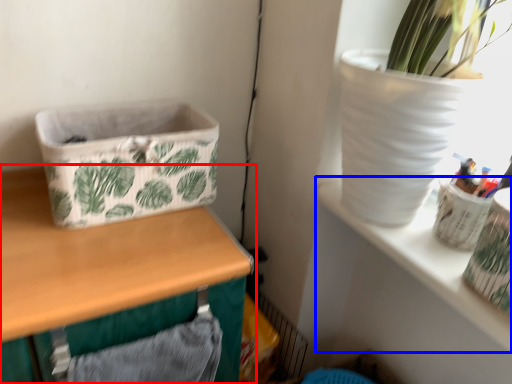
Question: Which point is further to the camera, table (highlighted by a red box) or shelf (highlighted by a blue box)?

Choices:
 (A) table
 (B) shelf

Answer: (B)